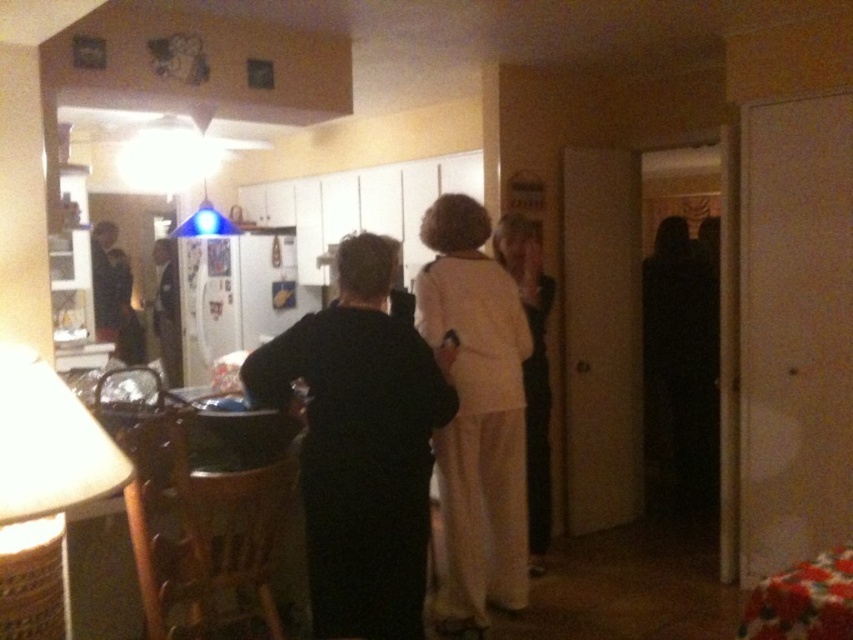
You are organizing a charity event and need to decide which items to display. Given the white fabric dress at center and the dark brown leather jacket at left, which item takes up less space and would be better suited for a compact display area?

The white fabric dress at center occupies less space than the dark brown leather jacket at left, making it better suited for a compact display area.

You are standing at the point labeled point [508,556] in the image. You want to walk towards the point labeled point [320,404]. Will you be moving forward or backward relative to your current position?

Since point [320,404] is in front of point [508,556], moving towards it would mean moving forward relative to your current position at point [508,556].